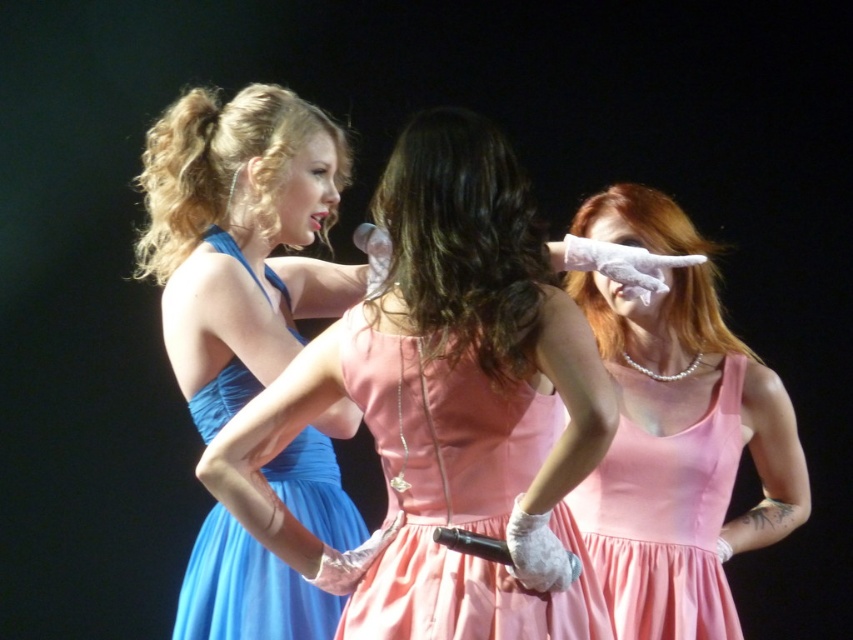
Question: Is matte blue dress at left below pink satin dress at center?

Choices:
 (A) no
 (B) yes

Answer: (A)

Question: Which of the following is the closest to the observer?

Choices:
 (A) peach satin dress at center
 (B) blue satin dress at left
 (C) pearl necklace at upper right

Answer: (A)

Question: Which point is closer to the camera?

Choices:
 (A) (468, 204)
 (B) (630, 624)

Answer: (A)

Question: Does pink satin dress at center appear over blue satin dress at left?

Choices:
 (A) yes
 (B) no

Answer: (B)

Question: Is matte blue dress at left wider than blue satin dress at left?

Choices:
 (A) no
 (B) yes

Answer: (B)

Question: Which object is farther from the camera taking this photo?

Choices:
 (A) matte blue dress at left
 (B) pearl necklace at upper right
 (C) pink satin dress at center
 (D) peach satin dress at center

Answer: (C)